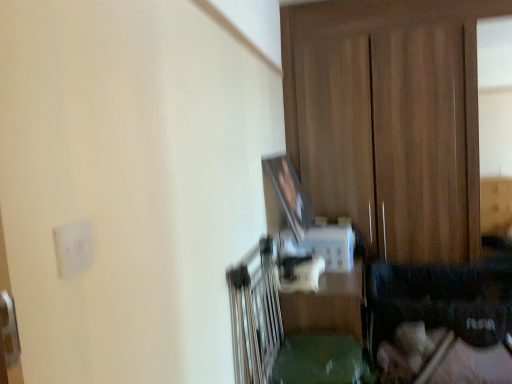
Question: Looking at the image, does wooden dresser at center seem bigger or smaller compared to green plastic table at center?

Choices:
 (A) big
 (B) small

Answer: (A)

Question: In terms of width, does wooden dresser at center look wider or thinner when compared to green plastic table at center?

Choices:
 (A) thin
 (B) wide

Answer: (A)

Question: Considering the real-world distances, which object is farthest from the white matte electric outlet at upper left?

Choices:
 (A) wooden dresser at center
 (B) green plastic table at center

Answer: (A)

Question: Which is nearer to the green plastic table at center?

Choices:
 (A) wooden dresser at center
 (B) white matte electric outlet at upper left

Answer: (A)